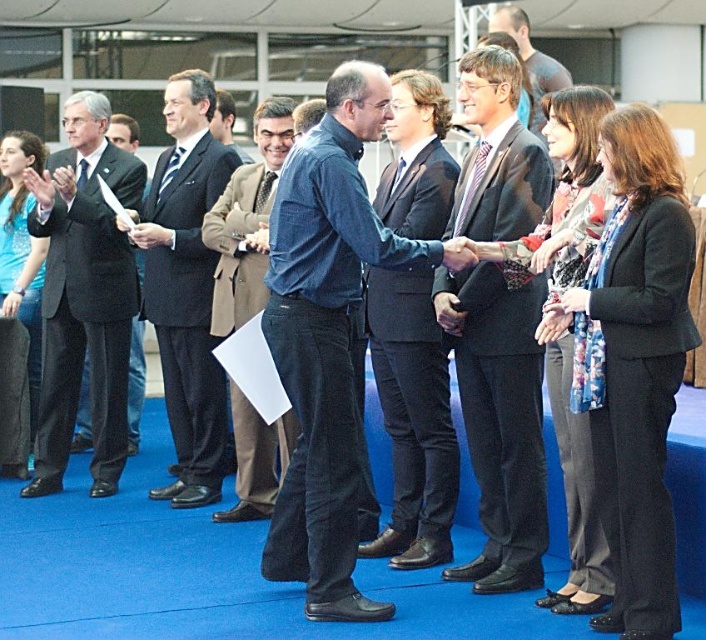
Question: Considering the relative positions of blue denim shirt at center and dark blue suit at center in the image provided, where is blue denim shirt at center located with respect to dark blue suit at center?

Choices:
 (A) above
 (B) below

Answer: (B)

Question: Does black wool suit at right come in front of matte blue shirt at center?

Choices:
 (A) yes
 (B) no

Answer: (A)

Question: Which object appears closest to the camera in this image?

Choices:
 (A) blue denim jeans at center
 (B) blue denim shirt at center

Answer: (B)

Question: Can you confirm if dark suit at center is thinner than dark blue suit at center?

Choices:
 (A) yes
 (B) no

Answer: (A)

Question: Which object is closer to the camera taking this photo?

Choices:
 (A) black wool suit at center
 (B) blue denim shirt at center
 (C) black wool suit at right
 (D) matte blue shirt at center

Answer: (C)

Question: Which object is farther from the camera taking this photo?

Choices:
 (A) dark suit at left
 (B) blue denim jeans at center

Answer: (A)